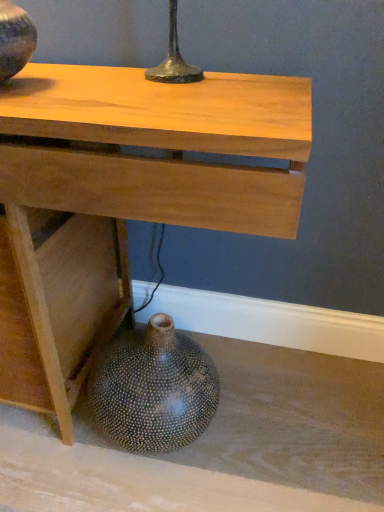
This screenshot has height=512, width=384. In order to click on vacant area that is situated to the right of speckled ceramic vase at lower left, the 1th vase when ordered from right to left in this screenshot , I will do click(262, 423).